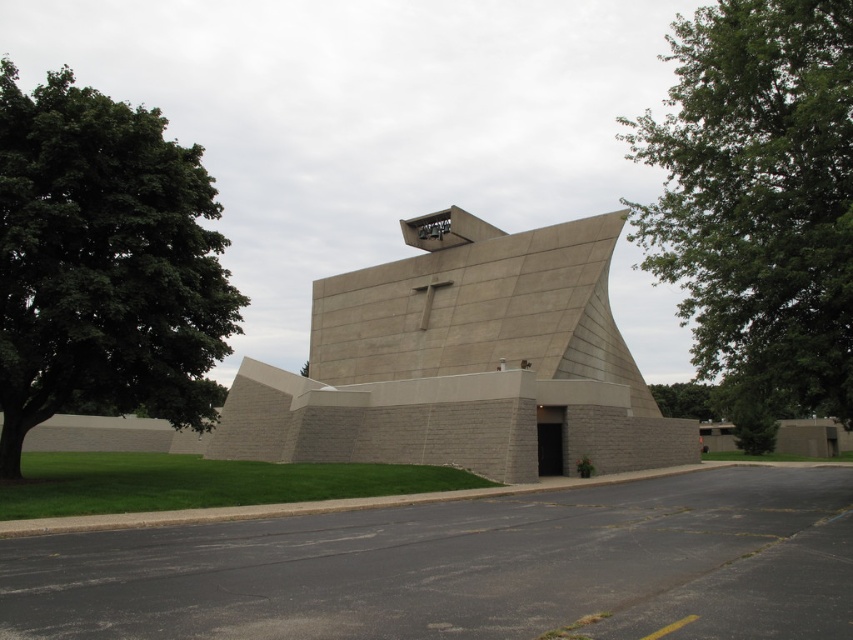
Consider the image. Is gray concrete church at center further to camera compared to green leafy tree at upper right?

Yes, gray concrete church at center is further from the viewer.

Does point (357, 385) lie behind point (827, 172)?

That is True.

Between point (653, 420) and point (762, 148), which one is positioned behind?

The point (653, 420) is behind.

Where is `gray concrete church at center`? The image size is (853, 640). gray concrete church at center is located at coordinates (462, 362).

Does green leafy tree at left have a lesser height compared to green leafy tree at lower right?

In fact, green leafy tree at left may be taller than green leafy tree at lower right.

Does green leafy tree at left have a greater height compared to green leafy tree at lower right?

Indeed, green leafy tree at left has a greater height compared to green leafy tree at lower right.

Is point (171, 316) less distant than point (700, 385)?

Yes.

Locate an element on the screen. The image size is (853, 640). green leafy tree at left is located at coordinates (103, 262).

Describe the element at coordinates (758, 198) in the screenshot. I see `green leafy tree at upper right` at that location.

Which is more to the right, green leafy tree at upper right or green leafy tree at lower right?

green leafy tree at upper right

Is point (782, 243) farther from viewer compared to point (697, 401)?

No, it is not.

Locate an element on the screen. This screenshot has width=853, height=640. green leafy tree at upper right is located at coordinates (758, 198).